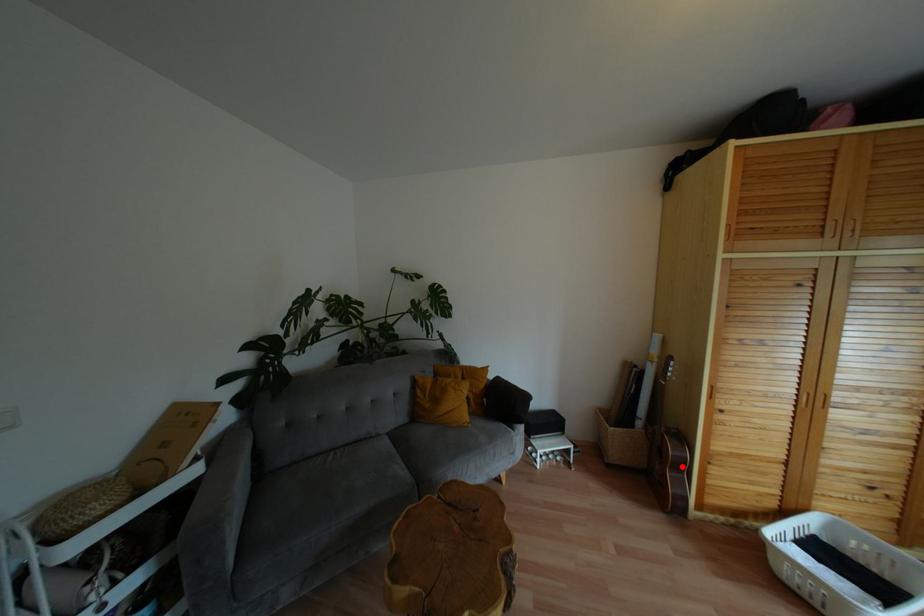
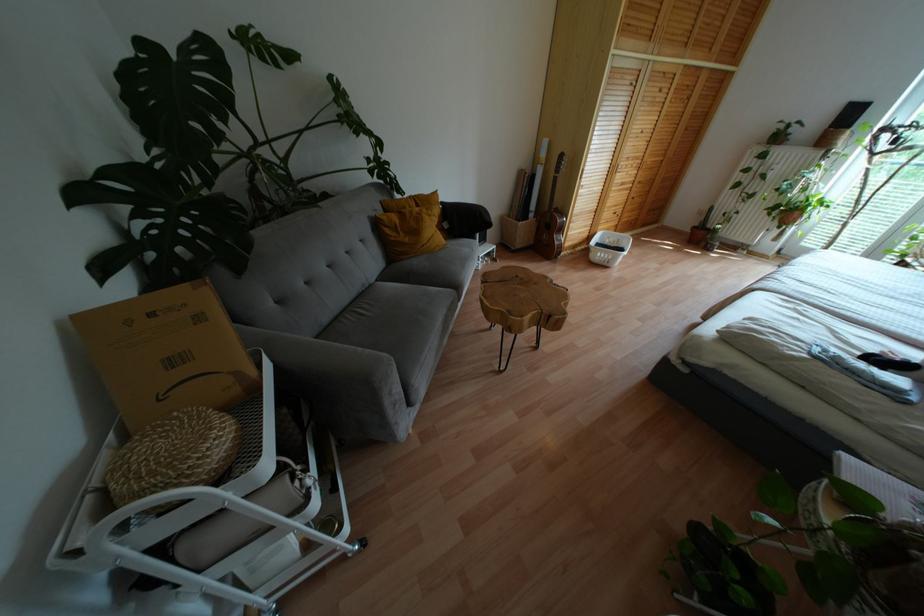
Locate, in the second image, the point that corresponds to the highlighted location in the first image.

(560, 229)